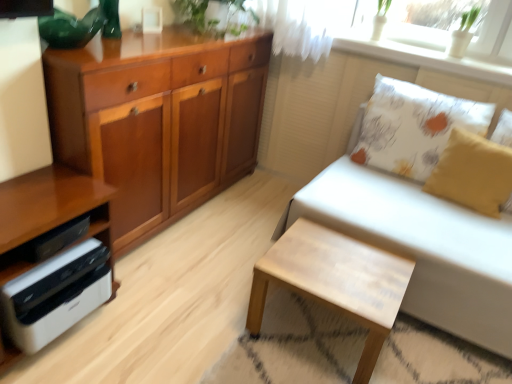
Find the location of a particular element. The image size is (512, 384). vacant space to the right of white glossy printer at lower left is located at coordinates (145, 324).